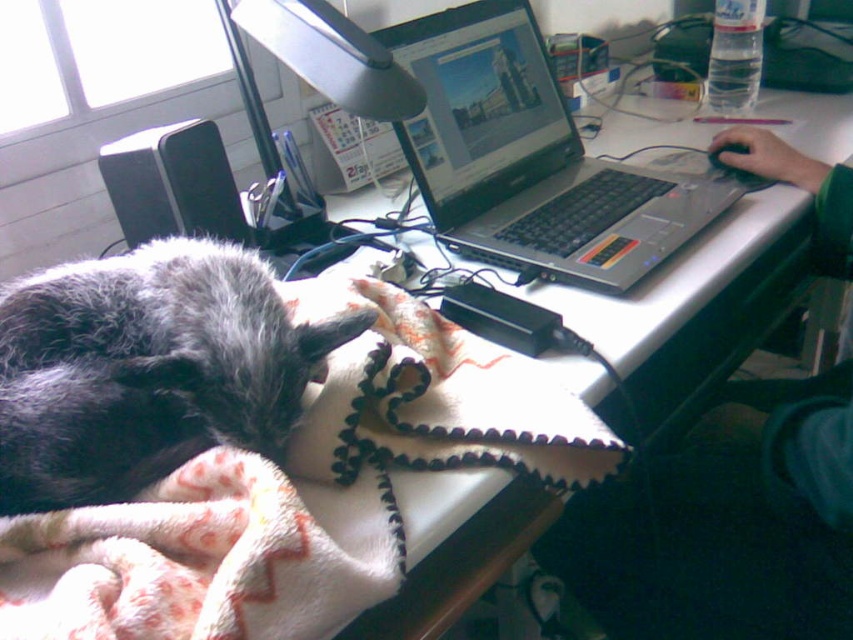
You are organizing the workspace and want to place a new plant pot between the white fleece blanket at lower left and the fluffy gray cat at lower left. Is there enough vertical space between them to fit the plant pot?

The white fleece blanket at lower left is below the fluffy gray cat at lower left, so there is vertical space between them. The plant pot can be placed in between as long as its height doesn